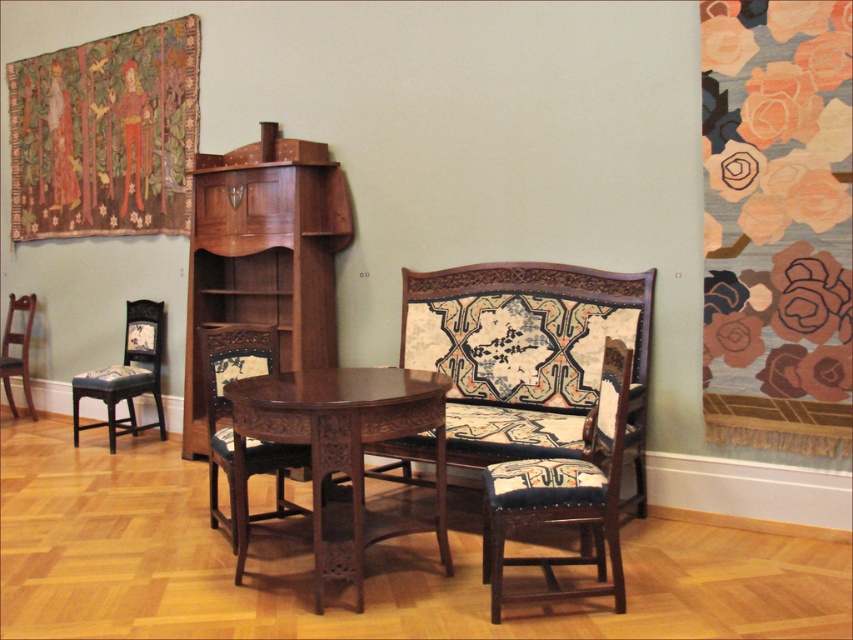
What are the coordinates of `dark blue fabric armchair at center` in the screenshot? It's located at (564, 497).

Is dark blue fabric armchair at center wider than matte black chair at left?

No.

Which is in front, point (616, 609) or point (96, 369)?

Point (616, 609) is more forward.

Where is `dark blue fabric armchair at center`? dark blue fabric armchair at center is located at coordinates (564, 497).

How far apart are richly colored fabric tapestry at upper left and mahogany wood table at center?

3.15 meters

Who is more forward, (25, 173) or (358, 413)?

Point (358, 413)

Is point (157, 29) farther from viewer compared to point (332, 572)?

Yes.

Identify the location of richly colored fabric tapestry at upper left. This screenshot has width=853, height=640. (105, 134).

The image size is (853, 640). What are the coordinates of `floral-patterned fabric at right` in the screenshot? It's located at (776, 225).

Does point (807, 138) come in front of point (73, 387)?

Yes, it is in front of point (73, 387).

Image resolution: width=853 pixels, height=640 pixels. I want to click on floral-patterned fabric at right, so click(x=776, y=225).